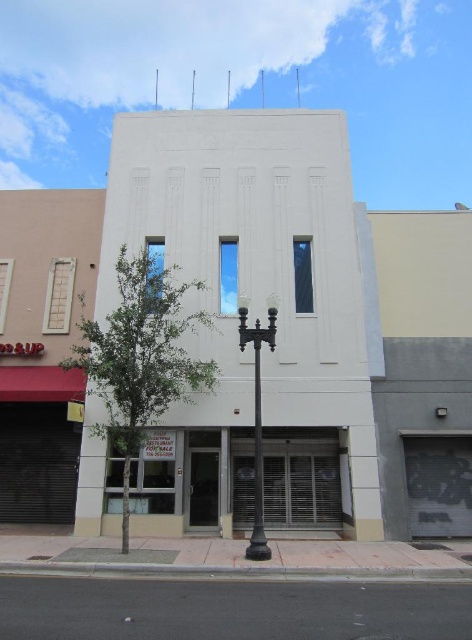
You are a delivery person trying to access the entrance of the building. You see the metallic silver storefront at center and the black metal pole at center. Which object is closer to you?

The metallic silver storefront at center is closer to you than the black metal pole at center because the black metal pole at center is positioned behind the metallic silver storefront at center.

You are a delivery person trying to access the entrance of the building. You see the metallic silver storefront at center and the black metal pole at center. Which object is closer to the ground?

The metallic silver storefront at center is closer to the ground than the black metal pole at center because it is positioned below it.